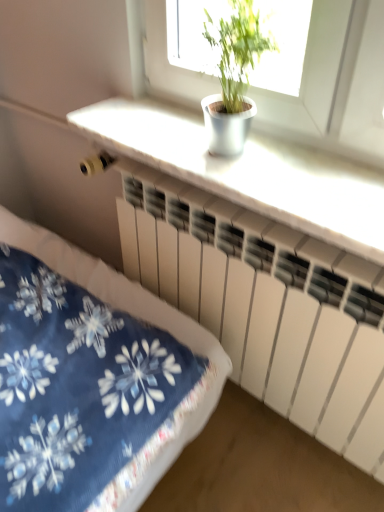
Question: From a real-world perspective, is green leafy plant at upper center over white matte counter top at upper center?

Choices:
 (A) no
 (B) yes

Answer: (B)

Question: Is green leafy plant at upper center oriented towards white matte counter top at upper center?

Choices:
 (A) yes
 (B) no

Answer: (B)

Question: Is green leafy plant at upper center bigger than white matte counter top at upper center?

Choices:
 (A) no
 (B) yes

Answer: (A)

Question: Is green leafy plant at upper center far from white matte counter top at upper center?

Choices:
 (A) no
 (B) yes

Answer: (A)

Question: Is green leafy plant at upper center wider than white matte counter top at upper center?

Choices:
 (A) no
 (B) yes

Answer: (A)

Question: Does green leafy plant at upper center lie in front of white matte counter top at upper center?

Choices:
 (A) no
 (B) yes

Answer: (B)

Question: Considering the relative sizes of white matte counter top at upper center and green leafy plant at upper center in the image provided, is white matte counter top at upper center thinner than green leafy plant at upper center?

Choices:
 (A) no
 (B) yes

Answer: (A)

Question: Is white matte counter top at upper center taller than green leafy plant at upper center?

Choices:
 (A) yes
 (B) no

Answer: (B)

Question: Is the position of white matte counter top at upper center more distant than that of green leafy plant at upper center?

Choices:
 (A) no
 (B) yes

Answer: (B)

Question: Considering the relative positions of white matte counter top at upper center and green leafy plant at upper center in the image provided, is white matte counter top at upper center in front of green leafy plant at upper center?

Choices:
 (A) yes
 (B) no

Answer: (B)

Question: From the image's perspective, does white matte counter top at upper center appear higher than green leafy plant at upper center?

Choices:
 (A) no
 (B) yes

Answer: (A)

Question: From a real-world perspective, is white matte counter top at upper center located beneath green leafy plant at upper center?

Choices:
 (A) no
 (B) yes

Answer: (B)

Question: Does white matte counter top at upper center have a greater height compared to white matte radiator at center?

Choices:
 (A) no
 (B) yes

Answer: (A)